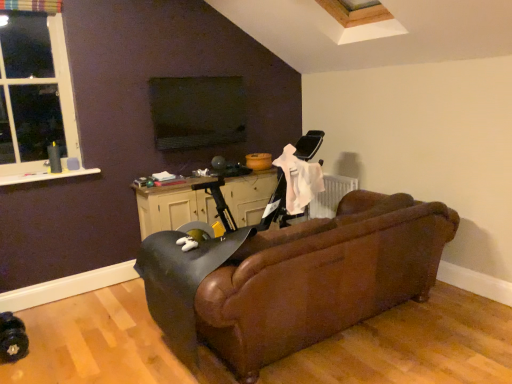
Question: In terms of size, does black matte table at center appear bigger or smaller than white plastic window at upper left?

Choices:
 (A) big
 (B) small

Answer: (A)

Question: From a real-world perspective, is black matte table at center physically located above or below white plastic window at upper left?

Choices:
 (A) above
 (B) below

Answer: (B)

Question: Which is farther from the white plastic window at upper left?

Choices:
 (A) black matte table at center
 (B) brown leather couch at center
 (C) leather swivel chair at center

Answer: (B)

Question: Estimate the real-world distances between objects in this image. Which object is closer to the brown leather couch at center?

Choices:
 (A) white plastic window at upper left
 (B) leather swivel chair at center
 (C) black matte table at center

Answer: (B)